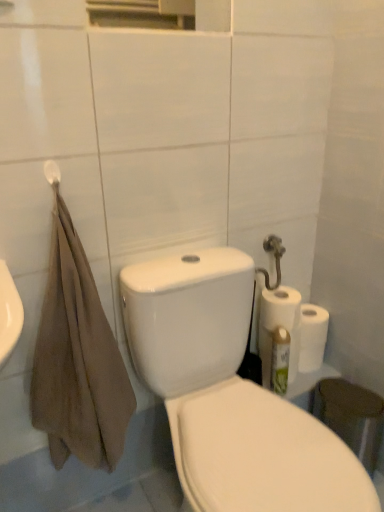
Measure the distance between green matte cleaning product at right and camera.

green matte cleaning product at right and camera are 4.16 feet apart.

At what (x,y) coordinates should I click in order to perform the action: click on white matte paper towel at right. Please return your answer as a coordinate pair (x, y). This screenshot has width=384, height=512. Looking at the image, I should click on (280, 308).

Consider the image. Between white matte paper towel at right and white matte towel bar at upper left, which one appears on the right side from the viewer's perspective?

white matte paper towel at right is more to the right.

From the image's perspective, which one is positioned lower, white matte paper towel at right or white matte towel bar at upper left?

white matte paper towel at right is shown below in the image.

Identify the location of paper towel below the white matte towel bar at upper left (from the image's perspective). This screenshot has height=512, width=384. (280, 308).

Is white matte paper towel at right oriented away from white matte towel bar at upper left?

No, white matte paper towel at right's orientation is not away from white matte towel bar at upper left.

Which is closer to the camera, (288, 308) or (188, 405)?

Clearly, point (288, 308) is more distant from the camera than point (188, 405).

Which object is thinner, white matte paper towel at right or white glossy porcelain at center?

white matte paper towel at right.

Is white matte paper towel at right taller than white glossy porcelain at center?

No, white matte paper towel at right is not taller than white glossy porcelain at center.

Does white matte paper towel at right touch white glossy porcelain at center?

No, white matte paper towel at right is not touching white glossy porcelain at center.

From the picture: Is white matte towel bar at upper left bigger than brown cotton towel at left?

Actually, white matte towel bar at upper left might be smaller than brown cotton towel at left.

Looking at this image, which object is further away from the camera taking this photo, white matte towel bar at upper left or brown cotton towel at left?

Positioned behind is white matte towel bar at upper left.

Is brown cotton towel at left surrounded by white matte towel bar at upper left?

That's incorrect, brown cotton towel at left is not inside white matte towel bar at upper left.

From the picture: Can you confirm if white matte towel bar at upper left is shorter than brown cotton towel at left?

Yes, white matte towel bar at upper left is shorter than brown cotton towel at left.

From a real-world perspective, is white glossy porcelain at center beneath white matte towel bar at upper left?

Yes, from a real-world perspective, white glossy porcelain at center is below white matte towel bar at upper left.

Would you consider white glossy porcelain at center to be distant from white matte towel bar at upper left?

They are positioned close to each other.

Which object is closer to the camera, white glossy porcelain at center or white matte towel bar at upper left?

white glossy porcelain at center.

Considering the relative positions of white glossy porcelain at center and white matte towel bar at upper left in the image provided, is white glossy porcelain at center to the left or to the right of white matte towel bar at upper left?

Clearly, white glossy porcelain at center is on the right of white matte towel bar at upper left in the image.

Which object is thinner, white glossy porcelain at center or green matte cleaning product at right?

green matte cleaning product at right.

Does white glossy porcelain at center lie behind green matte cleaning product at right?

No, the depth of white glossy porcelain at center is less than that of green matte cleaning product at right.

From the picture: Is white glossy porcelain at center facing away from green matte cleaning product at right?

That's not correct — white glossy porcelain at center is not looking away from green matte cleaning product at right.

From the image's perspective, would you say white glossy porcelain at center is positioned over green matte cleaning product at right?

Incorrect, from the image's perspective, white glossy porcelain at center is lower than green matte cleaning product at right.

What's the angular difference between white matte paper towel at right and green matte cleaning product at right's facing directions?

The angular difference between white matte paper towel at right and green matte cleaning product at right is 2.15 degrees.

Considering the sizes of objects white matte paper towel at right and green matte cleaning product at right in the image provided, who is shorter, white matte paper towel at right or green matte cleaning product at right?

Standing shorter between the two is white matte paper towel at right.

Where is `paper towel that appears on the right of green matte cleaning product at right`? paper towel that appears on the right of green matte cleaning product at right is located at coordinates (280, 308).

From a real-world perspective, does white matte paper towel at right sit lower than green matte cleaning product at right?

Actually, white matte paper towel at right is physically above green matte cleaning product at right in the real world.

Does white glossy porcelain at center have a lesser width compared to white matte paper towel at right?

Incorrect, the width of white glossy porcelain at center is not less than that of white matte paper towel at right.

From a real-world perspective, is white glossy porcelain at center positioned over white matte paper towel at right based on gravity?

Incorrect, from a real-world perspective, white glossy porcelain at center is lower than white matte paper towel at right.

Which is in front, point (188, 390) or point (289, 327)?

Point (188, 390)

Who is taller, white glossy porcelain at center or white matte paper towel at right?

Standing taller between the two is white glossy porcelain at center.

Identify the location of paper towel behind the white matte towel bar at upper left. (280, 308).

Identify the location of paper towel above the white glossy porcelain at center (from a real-world perspective). This screenshot has height=512, width=384. (280, 308).

From the image, which object appears to be farther from brown cotton towel at left, white matte paper towel at right or green matte cleaning product at right?

white matte paper towel at right is further to brown cotton towel at left.

Which object lies further to the anchor point brown cotton towel at left, white matte paper towel at right or white matte towel bar at upper left?

The object further to brown cotton towel at left is white matte towel bar at upper left.

Looking at the image, which one is located further to white matte towel bar at upper left, white matte paper towel at right or green matte cleaning product at right?

Based on the image, green matte cleaning product at right appears to be further to white matte towel bar at upper left.

Looking at the image, which one is located further to brown cotton towel at left, white matte towel bar at upper left or white matte paper towel at right?

The object further to brown cotton towel at left is white matte towel bar at upper left.

Based on their spatial positions, is green matte cleaning product at right or brown cotton towel at left further from white glossy porcelain at center?

Based on the image, brown cotton towel at left appears to be further to white glossy porcelain at center.

Estimate the real-world distances between objects in this image. Which object is closer to green matte cleaning product at right, white matte towel bar at upper left or brown cotton towel at left?

brown cotton towel at left.

Based on their spatial positions, is white glossy porcelain at center or brown cotton towel at left closer to white matte paper towel at right?

white glossy porcelain at center is closer to white matte paper towel at right.

Based on their spatial positions, is white matte towel bar at upper left or green matte cleaning product at right closer to brown cotton towel at left?

green matte cleaning product at right is closer to brown cotton towel at left.

Locate an element on the screen. Image resolution: width=384 pixels, height=512 pixels. towel bar positioned between white glossy porcelain at center and white matte paper towel at right from near to far is located at coordinates (52, 172).

This screenshot has height=512, width=384. Find the location of `cleaning product located between white glossy porcelain at center and white matte paper towel at right in the depth direction`. cleaning product located between white glossy porcelain at center and white matte paper towel at right in the depth direction is located at coordinates (280, 361).

Find the location of a particular element. The height and width of the screenshot is (512, 384). bath between white matte towel bar at upper left and white glossy porcelain at center in the up-down direction is located at coordinates (70, 459).

Locate an element on the screen. The height and width of the screenshot is (512, 384). towel bar located between white glossy porcelain at center and green matte cleaning product at right in the depth direction is located at coordinates (52, 172).